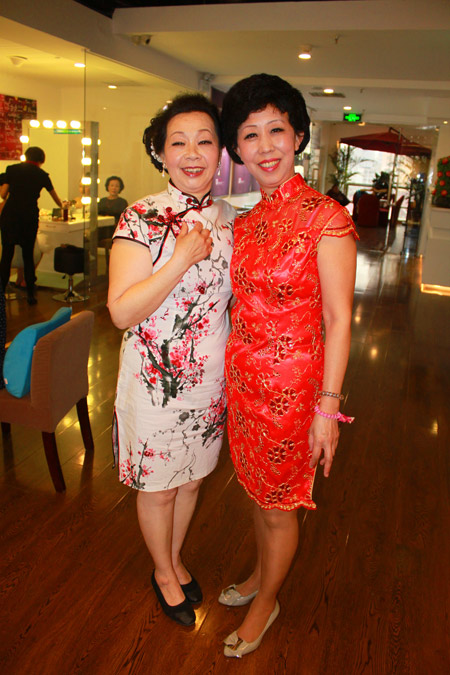
Image resolution: width=450 pixels, height=675 pixels. In order to click on beige wall in this screenshot , I will do `click(116, 115)`.